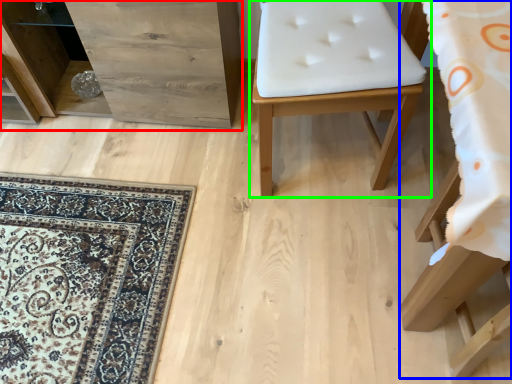
Question: Considering the real-world distances, which object is closest to dresser (highlighted by a red box)? furniture (highlighted by a blue box) or furniture (highlighted by a green box).

Choices:
 (A) furniture
 (B) furniture

Answer: (B)